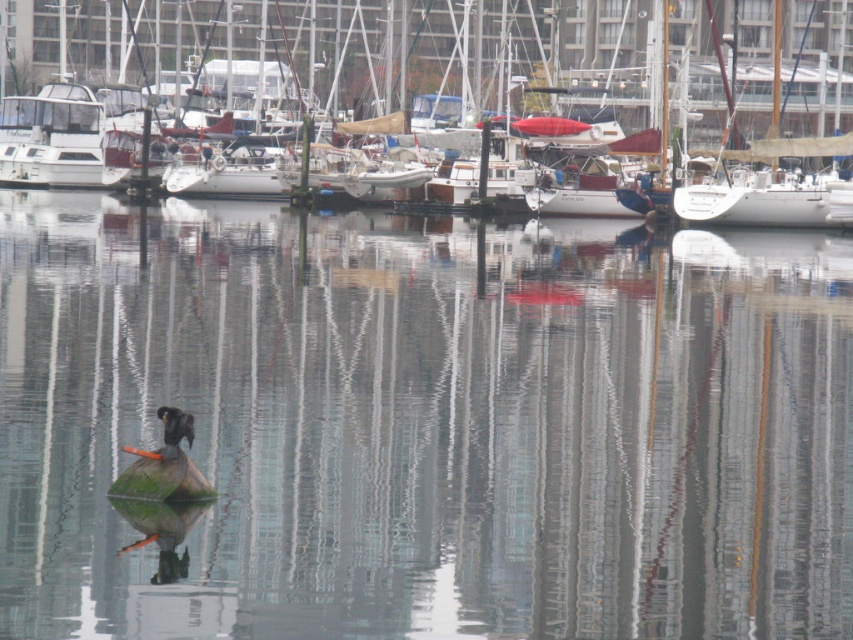
Question: Does white glossy sailboat at center appear under green fuzzy duck at center?

Choices:
 (A) no
 (B) yes

Answer: (A)

Question: Which of the following is the farthest from the observer?

Choices:
 (A) white glossy sailboat at center
 (B) clear water at center
 (C) green fuzzy duck at center

Answer: (A)

Question: Which point appears farthest from the camera in this image?

Choices:
 (A) (178, 490)
 (B) (579, 456)
 (C) (415, 67)

Answer: (C)

Question: Does clear water at center appear under green fuzzy duck at center?

Choices:
 (A) yes
 (B) no

Answer: (B)

Question: Which of the following is the farthest from the observer?

Choices:
 (A) white glossy sailboat at center
 (B) green fuzzy duck at center

Answer: (A)

Question: Does clear water at center appear under green fuzzy duck at center?

Choices:
 (A) no
 (B) yes

Answer: (A)